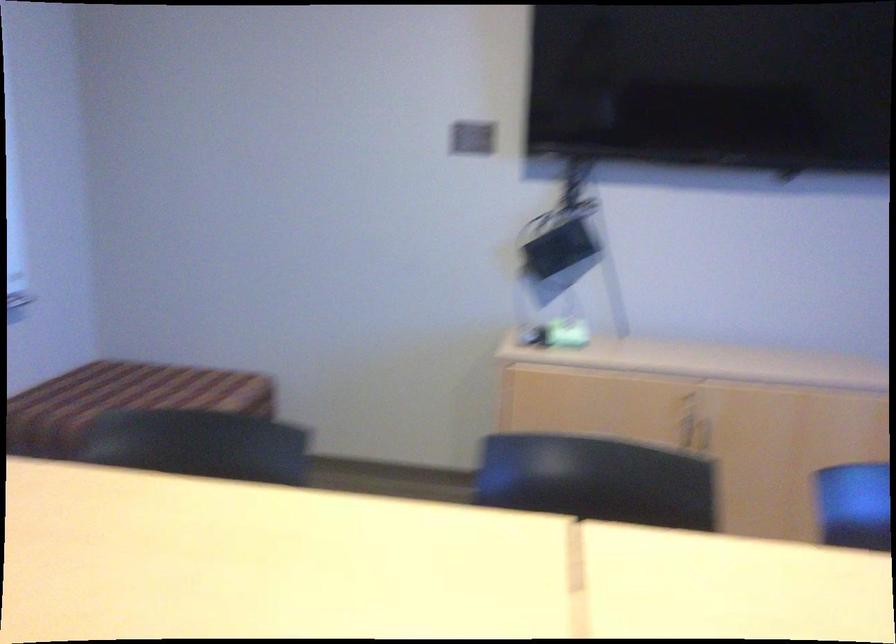
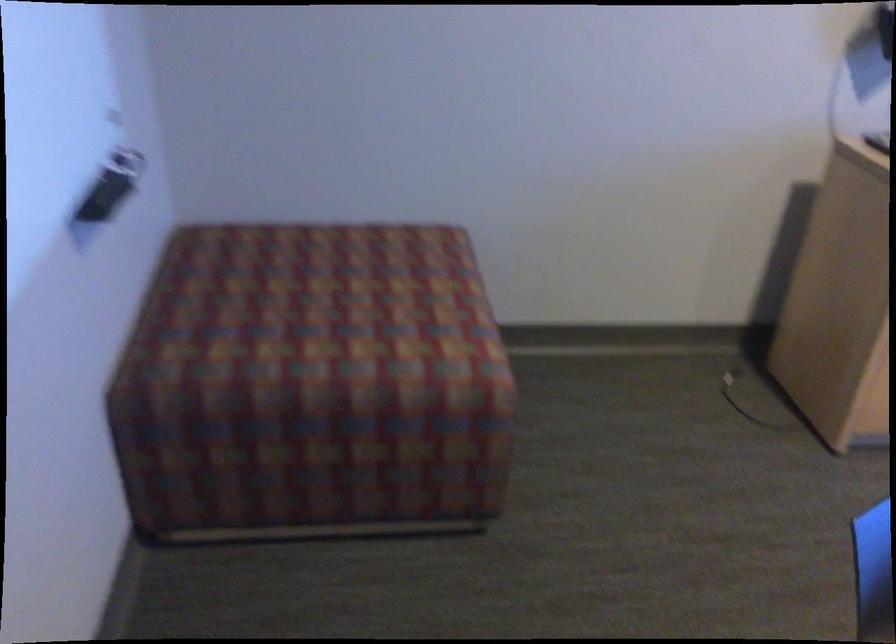
Find the pixel in the second image that matches point (122, 395) in the first image.

(332, 301)